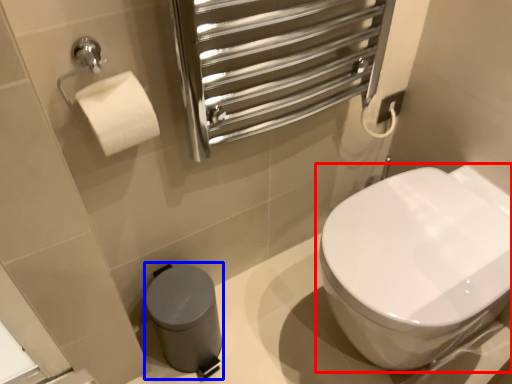
Question: Which of the following is the closest to the observer, toilet (highlighted by a red box) or porcelain (highlighted by a blue box)?

Choices:
 (A) toilet
 (B) porcelain

Answer: (A)